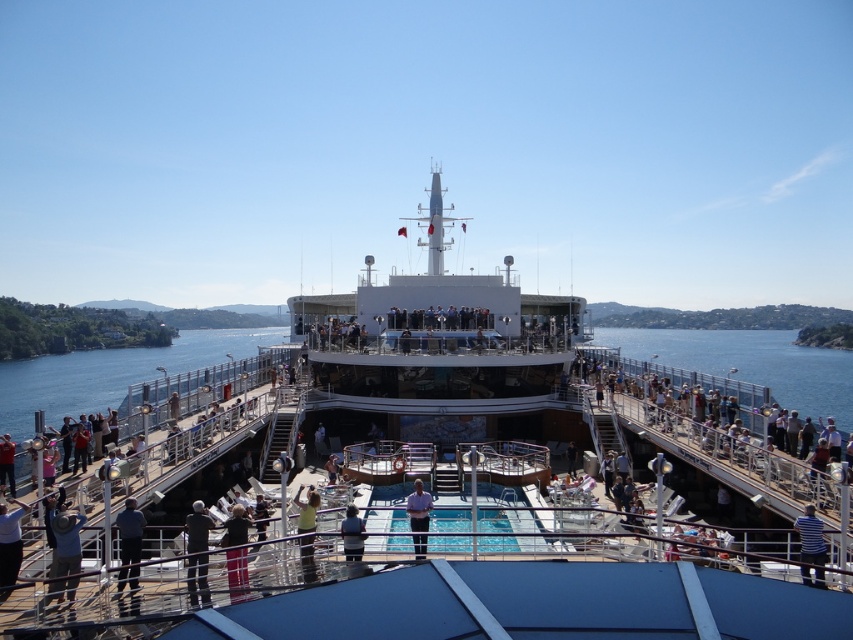
You are a photographer on the cruise ship deck and want to capture both the dark blue jeans at lower left and the dark gray fabric jacket at lower center in the same frame. Which object should you focus on first to ensure both are in the frame?

You should focus on the dark blue jeans at lower left first because it is larger than the dark gray fabric jacket at lower center, allowing you to frame both objects effectively.

Looking at this image, you are standing on the cruise ship deck and want to move from point A to point B. The coordinates for point A are point [202,580] and point B are point [236,536]. Since you want to take the shortest path, which point should you start from and which should you end at?

Point [202,580] is closer to the viewer than point [236,536]. Therefore, you should start at point [202,580] and end at point [236,536] to take the shortest path.

You are standing on the cruise ship deck and want to take a photo of both the point at coordinates (751, 618) and the point at (305, 534). Which point should you focus on first to ensure both are in focus?

You should focus on the point at coordinates (751, 618) first because it is closer to the camera than the point at (305, 534), ensuring both will be in focus when using depth of field.